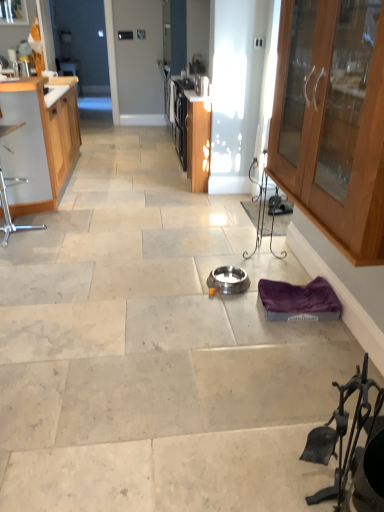
Image resolution: width=384 pixels, height=512 pixels. Find the location of `vacant area that lies between satin silver bowl at center, which appears as the first appliance when viewed from the front, and metallic silver chair at left, positioned as the 2th chair in right-to-left order`. vacant area that lies between satin silver bowl at center, which appears as the first appliance when viewed from the front, and metallic silver chair at left, positioned as the 2th chair in right-to-left order is located at coordinates (107, 256).